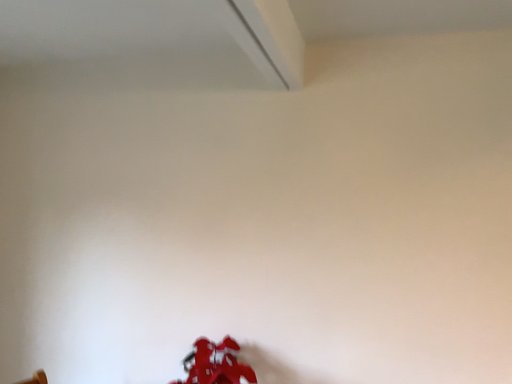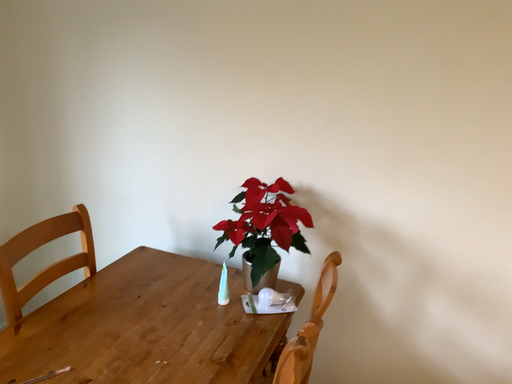
Question: How did the camera likely rotate when shooting the video?

Choices:
 (A) rotated upward
 (B) rotated downward

Answer: (B)